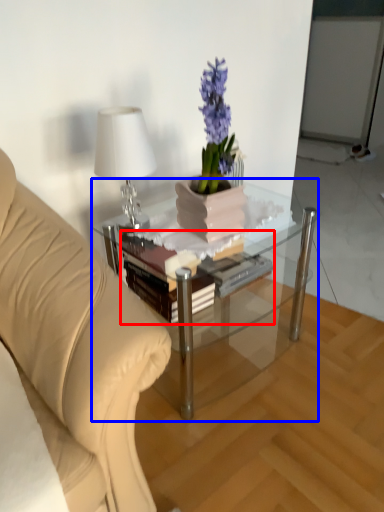
Question: Which of the following is the farthest to the observer, book (highlighted by a red box) or coffee table (highlighted by a blue box)?

Choices:
 (A) book
 (B) coffee table

Answer: (A)